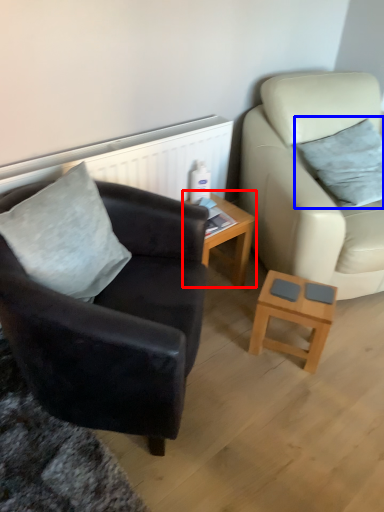
Question: Which object is further to the camera taking this photo, table (highlighted by a red box) or pillow (highlighted by a blue box)?

Choices:
 (A) table
 (B) pillow

Answer: (A)